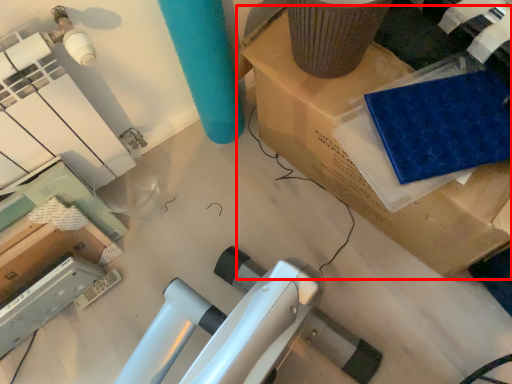
Question: From the image's perspective, what is the correct spatial relationship of furniture (annotated by the red box) in relation to fabric?

Choices:
 (A) above
 (B) below

Answer: (A)